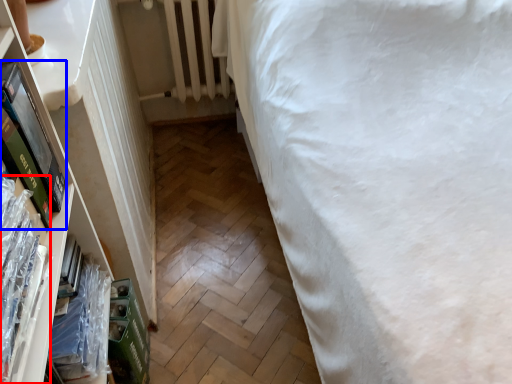
Question: Which point is closer to the camera, book (highlighted by a red box) or paperback book (highlighted by a blue box)?

Choices:
 (A) book
 (B) paperback book

Answer: (A)